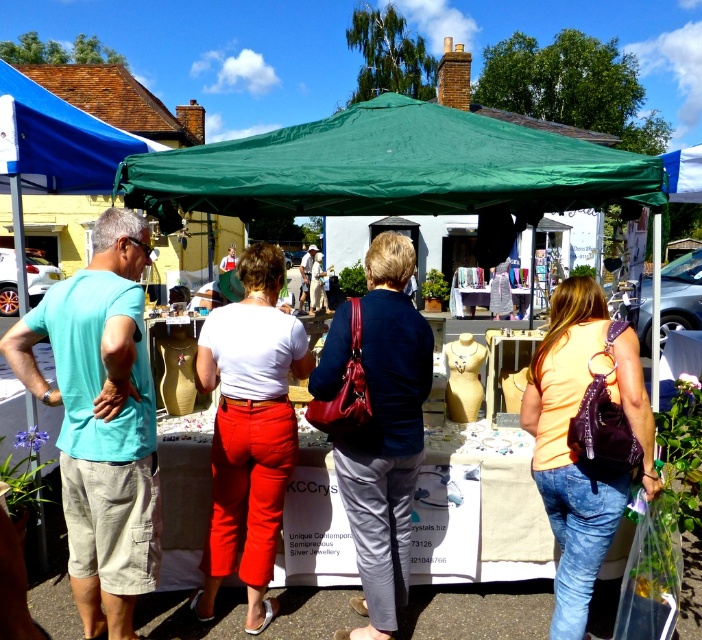
You are a delivery person who needs to place a large box that is 2 meters wide between the teal fabric shirt at left and orange matte backpack at right. Can you fit the box between them without moving either item?

The teal fabric shirt at left and orange matte backpack at right are 1.93 meters apart. Since the box is 2 meters wide, it cannot fit between them as the distance is slightly less than the box width.

You are standing at point (376, 291) and want to walk to the green canopy tent. Is the point (314, 138) behind you or in front of you?

The point (314, 138) is behind point (376, 291), so it is behind you.